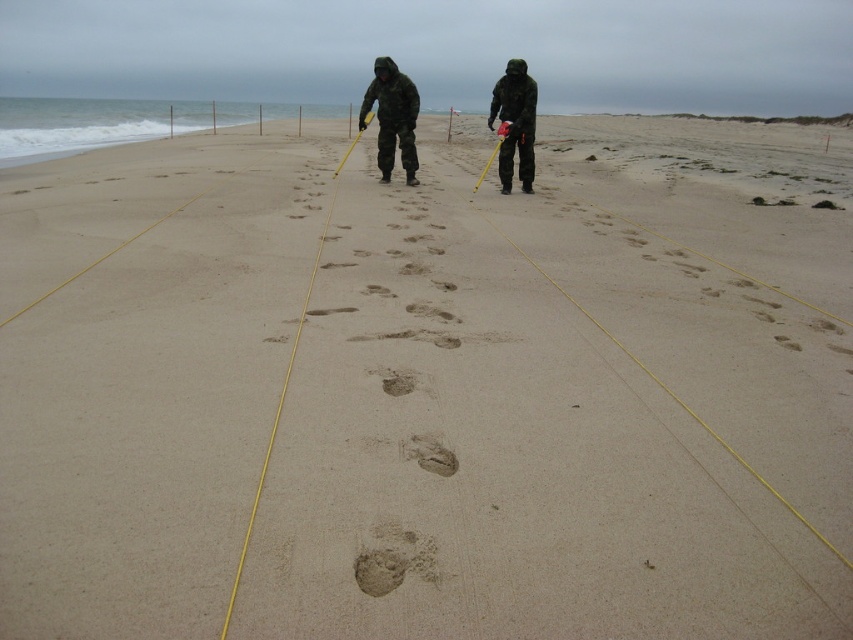
Question: Estimate the real-world distances between objects in this image. Which object is closer to the brown sandy footprint at center?

Choices:
 (A) camouflage fabric jacket at center
 (B) camouflage fabric person at center

Answer: (B)

Question: Is camouflage fabric jacket at center below brown sandy footprint at center?

Choices:
 (A) no
 (B) yes

Answer: (A)

Question: Which object is positioned farthest from the camouflage fabric person at center?

Choices:
 (A) camouflage fabric jacket at center
 (B) brown sandy footprint at center

Answer: (B)

Question: Can you confirm if camouflage fabric jacket at center is thinner than brown sandy footprint at center?

Choices:
 (A) no
 (B) yes

Answer: (A)

Question: Considering the real-world distances, which object is farthest from the brown sandy footprint at center?

Choices:
 (A) camouflage fabric jacket at center
 (B) camouflage fabric person at center

Answer: (A)

Question: Does camouflage fabric jacket at center appear over brown sandy footprint at center?

Choices:
 (A) no
 (B) yes

Answer: (B)